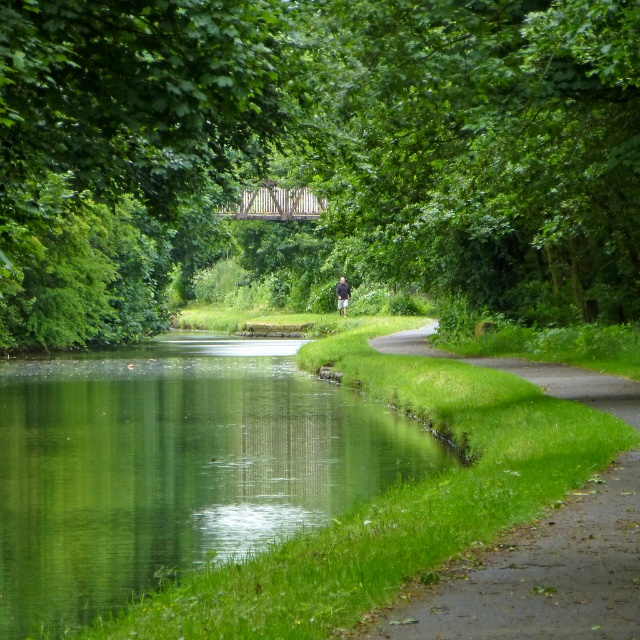
You are standing at point A and want to walk to point B. The path you take must stay on the paved path on the right side of the canal. Given that point A is at point (480, 211) and point B is at point (208, 477), which direction should you head to reach point B from point A?

To reach point B from point A, you should head towards the direction where point B is located, which is in front of point A since point A is behind point B. Therefore, move forward along the paved path towards point B at (208, 477).

You are standing at the point closer to the camera in the image. Which point are you at, point (x=496, y=257) or point (x=502, y=369)?

You are at point (x=496, y=257) because it is further to the camera than point (x=502, y=369).

Consider the image. You are standing at the center of the paved path on the right side of the canal. Looking towards the left side of the canal, can you see the green leafy tree at center?

Yes, the green leafy tree at center is located at point (314,157), so it is visible from the center of the paved path on the right side of the canal.